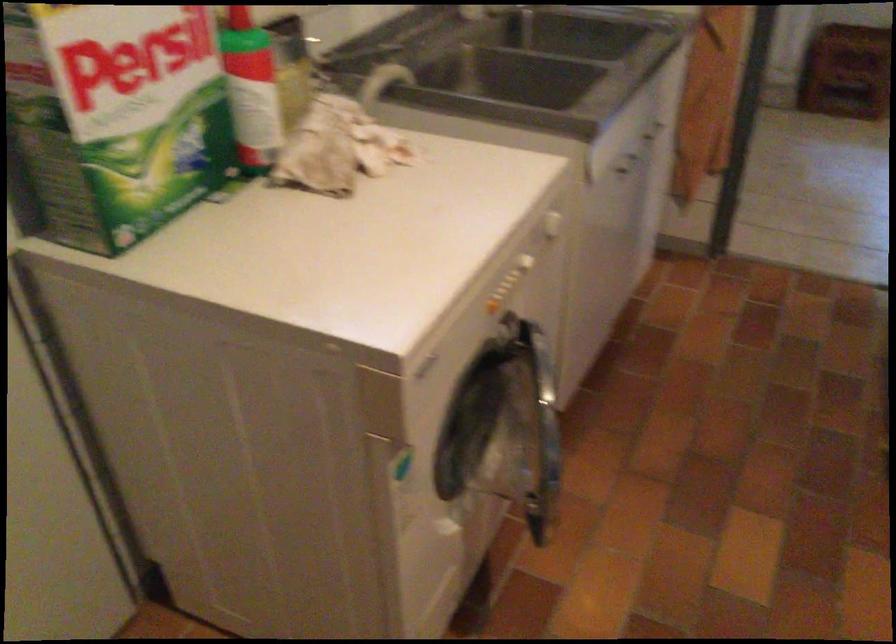
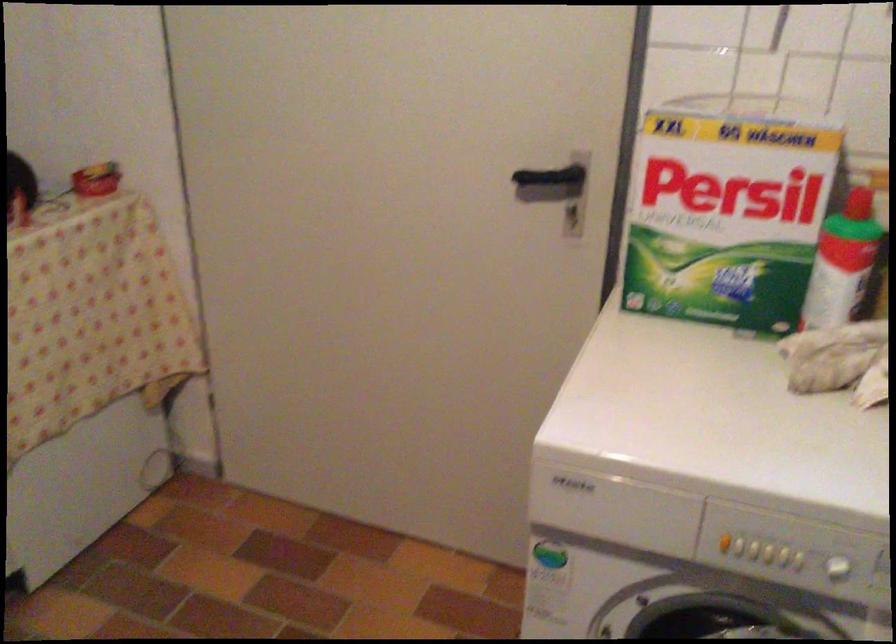
Find the pixel in the second image that matches point (522, 270) in the first image.

(843, 574)